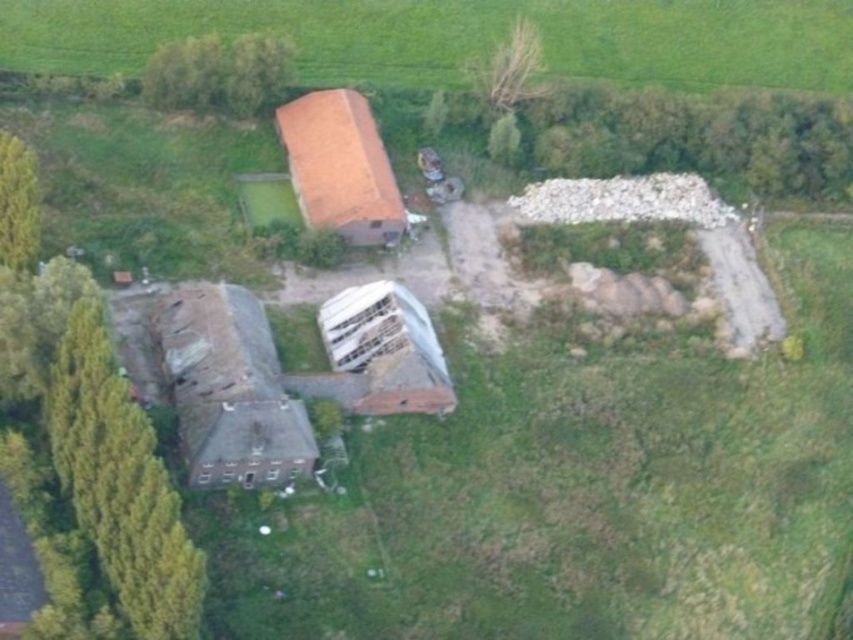
Question: Does green grass at upper center appear over brown tile roof at center?

Choices:
 (A) no
 (B) yes

Answer: (B)

Question: Does green grass at upper center appear on the right side of green leafy tree at left?

Choices:
 (A) no
 (B) yes

Answer: (B)

Question: Which point is farther to the camera?

Choices:
 (A) (791, 129)
 (B) (22, 250)
 (C) (189, 577)
 (D) (344, 221)

Answer: (A)

Question: Among these points, which one is farthest from the camera?

Choices:
 (A) (294, 156)
 (B) (769, 164)

Answer: (B)

Question: From the image, what is the correct spatial relationship of green leafy tree at lower left in relation to green leafy tree at upper center?

Choices:
 (A) below
 (B) above

Answer: (A)

Question: Which point is farther to the camera?

Choices:
 (A) (692, 77)
 (B) (352, 225)

Answer: (A)